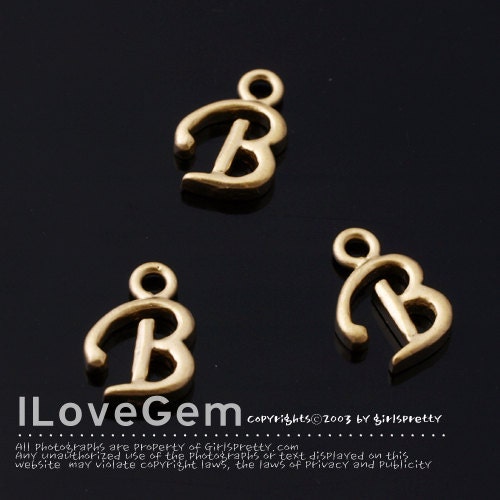
Identify the location of black countertop. This screenshot has width=500, height=500. (347, 115).